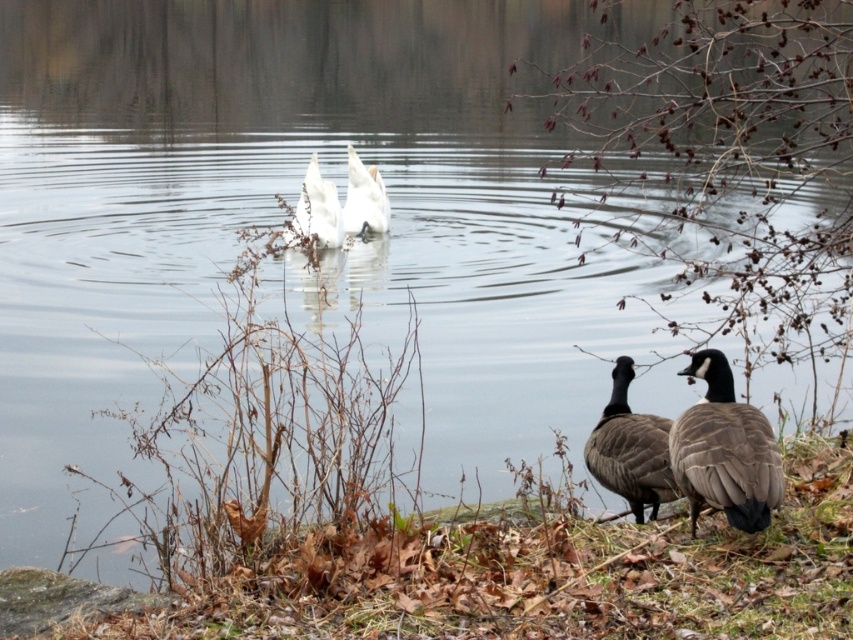
Question: Which object appears closest to the camera in this image?

Choices:
 (A) gray feathered duck at lower right
 (B) white matte goose at center
 (C) brown feathered duck at lower right
 (D) white glossy goose at center

Answer: (A)

Question: Considering the relative positions of gray feathered duck at lower right and brown feathered duck at lower right in the image provided, where is gray feathered duck at lower right located with respect to brown feathered duck at lower right?

Choices:
 (A) below
 (B) above

Answer: (B)

Question: Which of the following is the farthest from the observer?

Choices:
 (A) white glossy goose at center
 (B) gray feathered duck at lower right
 (C) white matte goose at center

Answer: (C)

Question: Does gray feathered duck at lower right appear under brown feathered duck at lower right?

Choices:
 (A) yes
 (B) no

Answer: (B)

Question: Can you confirm if brown feathered duck at lower right is thinner than white glossy goose at center?

Choices:
 (A) yes
 (B) no

Answer: (A)

Question: Among these objects, which one is farthest from the camera?

Choices:
 (A) gray feathered duck at lower right
 (B) brown feathered duck at lower right

Answer: (B)